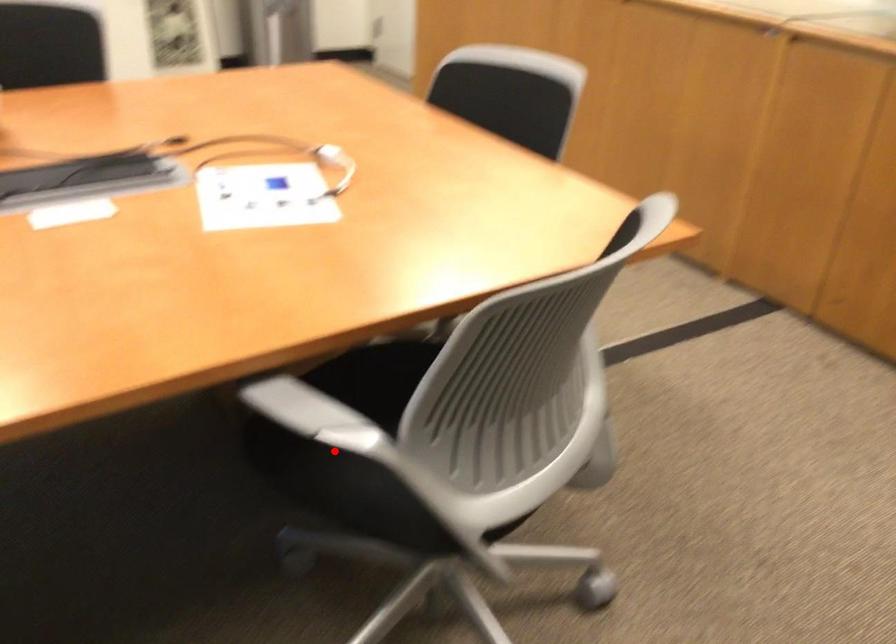
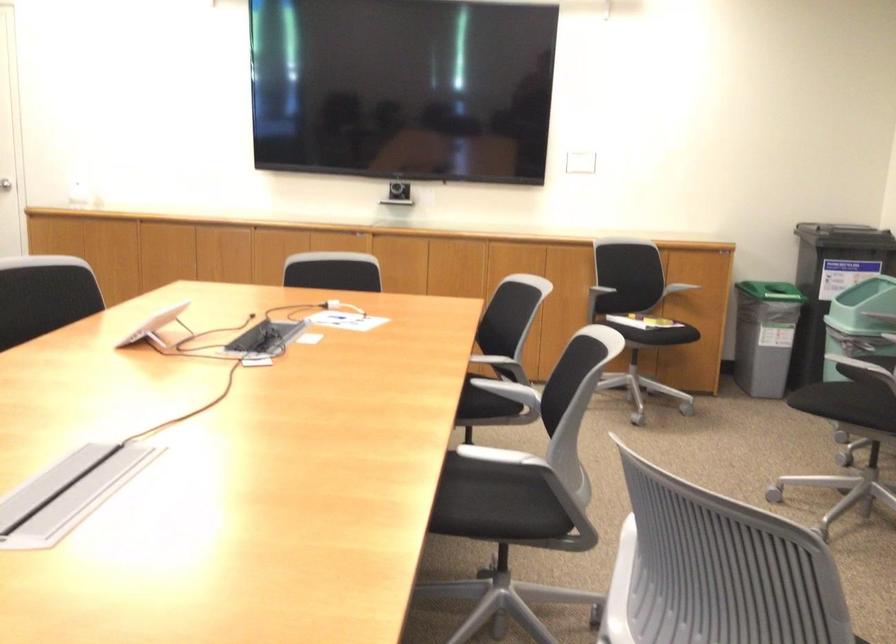
Question: I am providing you with two images of the same scene from different viewpoints. A red point is marked on the first image. At the location where the point appears in image 1, is it still visible in image 2?

Choices:
 (A) Yes
 (B) No

Answer: (A)